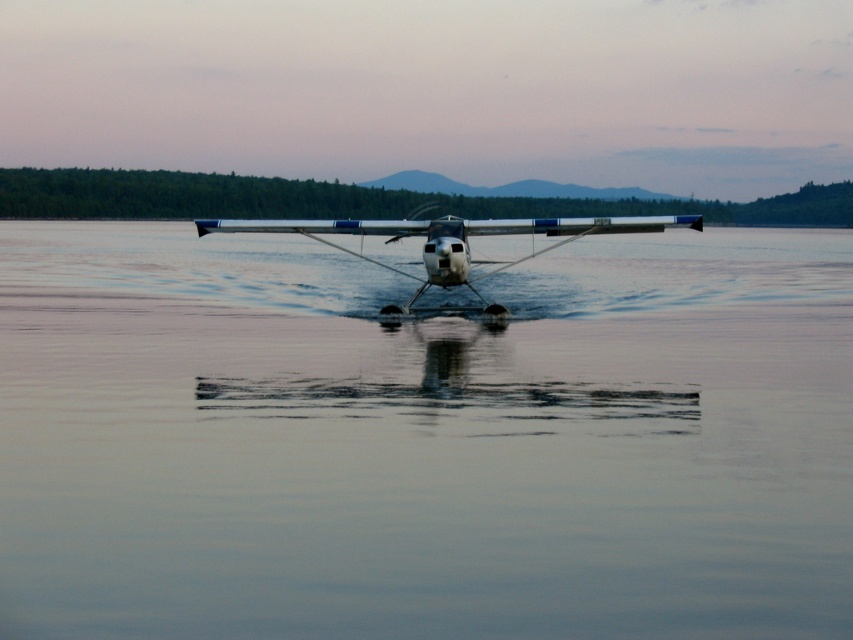
Question: Does smooth water at center come behind white glossy seaplane at center?

Choices:
 (A) yes
 (B) no

Answer: (B)

Question: Does smooth water at center have a larger size compared to white glossy seaplane at center?

Choices:
 (A) yes
 (B) no

Answer: (A)

Question: Which of the following is the farthest from the observer?

Choices:
 (A) (215, 516)
 (B) (282, 220)

Answer: (B)

Question: Which of the following is the farthest from the observer?

Choices:
 (A) (213, 228)
 (B) (612, 272)

Answer: (B)

Question: Is smooth water at center to the right of white glossy seaplane at center from the viewer's perspective?

Choices:
 (A) yes
 (B) no

Answer: (A)